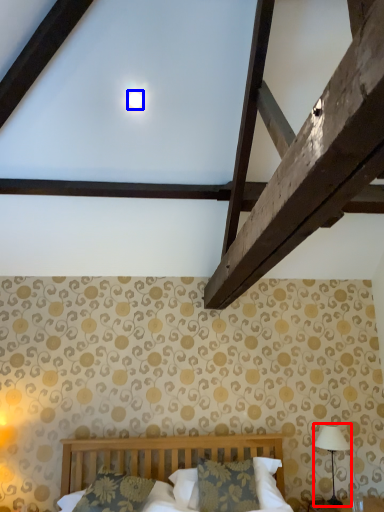
Question: Among these objects, which one is nearest to the camera, table lamp (highlighted by a red box) or moonlight (highlighted by a blue box)?

Choices:
 (A) table lamp
 (B) moonlight

Answer: (B)